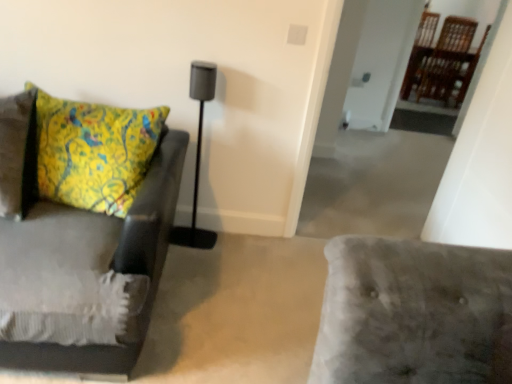
Question: Is matte black speaker at center thinner than velvet gray couch at left?

Choices:
 (A) yes
 (B) no

Answer: (A)

Question: Could you tell me if matte black speaker at center is facing velvet gray couch at left?

Choices:
 (A) no
 (B) yes

Answer: (A)

Question: Is matte black speaker at center positioned beyond the bounds of velvet gray couch at left?

Choices:
 (A) yes
 (B) no

Answer: (A)

Question: Would you say velvet gray couch at left is part of matte black speaker at center's contents?

Choices:
 (A) yes
 (B) no

Answer: (B)

Question: Can you confirm if matte black speaker at center is shorter than velvet gray couch at left?

Choices:
 (A) no
 (B) yes

Answer: (A)

Question: Is the depth of matte black speaker at center less than that of velvet gray couch at left?

Choices:
 (A) no
 (B) yes

Answer: (A)

Question: Does velvet gray couch at left appear on the right side of matte black speaker at center?

Choices:
 (A) no
 (B) yes

Answer: (A)

Question: Could you tell me if velvet gray couch at left is facing matte black speaker at center?

Choices:
 (A) no
 (B) yes

Answer: (A)

Question: Does velvet gray couch at left come behind matte black speaker at center?

Choices:
 (A) no
 (B) yes

Answer: (A)

Question: Is velvet gray couch at left taller than matte black speaker at center?

Choices:
 (A) no
 (B) yes

Answer: (A)

Question: From a real-world perspective, does velvet gray couch at left stand above matte black speaker at center?

Choices:
 (A) no
 (B) yes

Answer: (A)

Question: From a real-world perspective, is velvet gray couch at left located beneath matte black speaker at center?

Choices:
 (A) yes
 (B) no

Answer: (A)

Question: Considering the positions of velvet gray couch at left and matte black speaker at center in the image, is velvet gray couch at left wider or thinner than matte black speaker at center?

Choices:
 (A) wide
 (B) thin

Answer: (A)